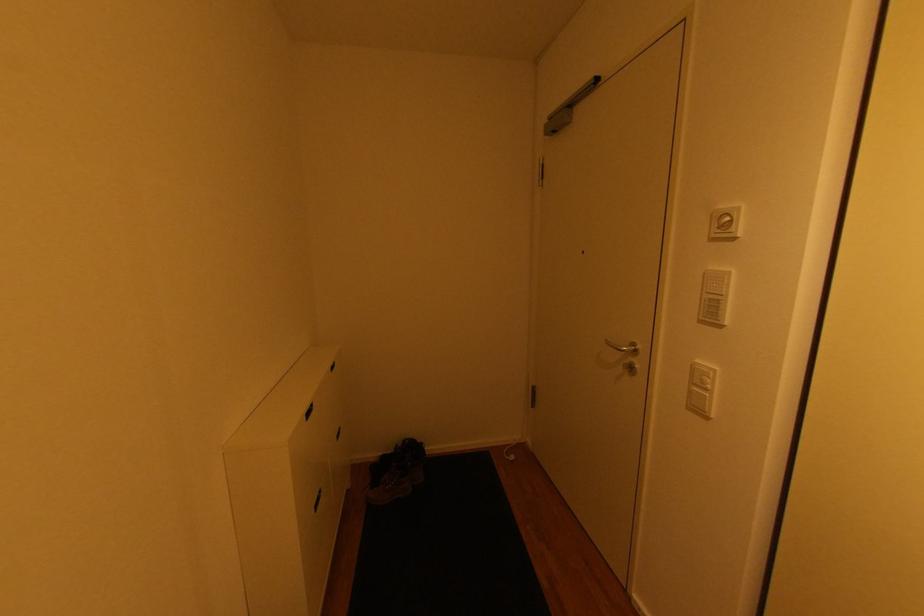
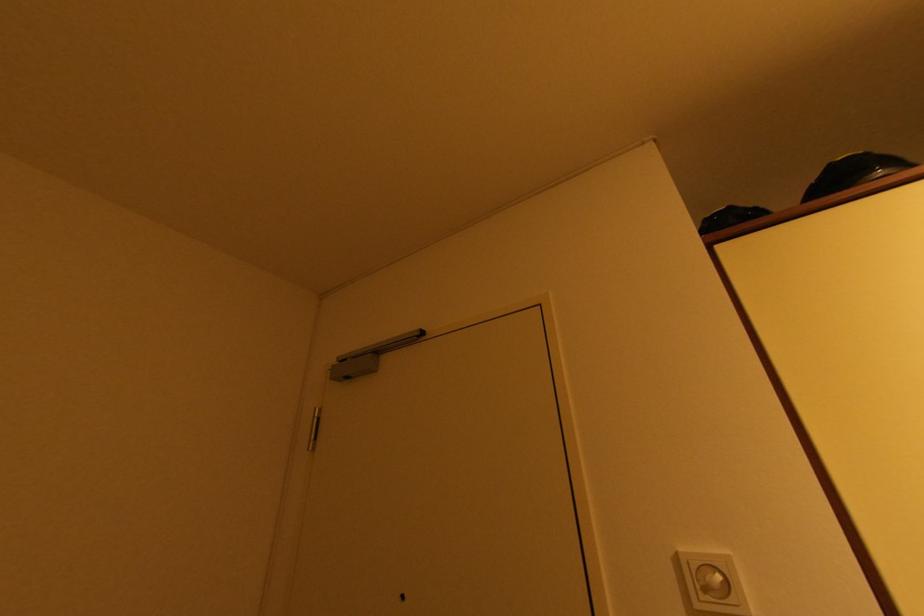
The images are taken continuously from a first-person perspective. In which direction is your viewpoint rotating?

The camera's rotation is toward right-up.